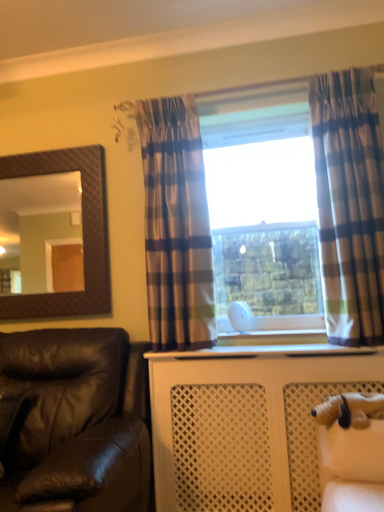
Where is `free point above brown textured mirror at upper left (from a real-world perspective)`? This screenshot has width=384, height=512. free point above brown textured mirror at upper left (from a real-world perspective) is located at coordinates (43, 153).